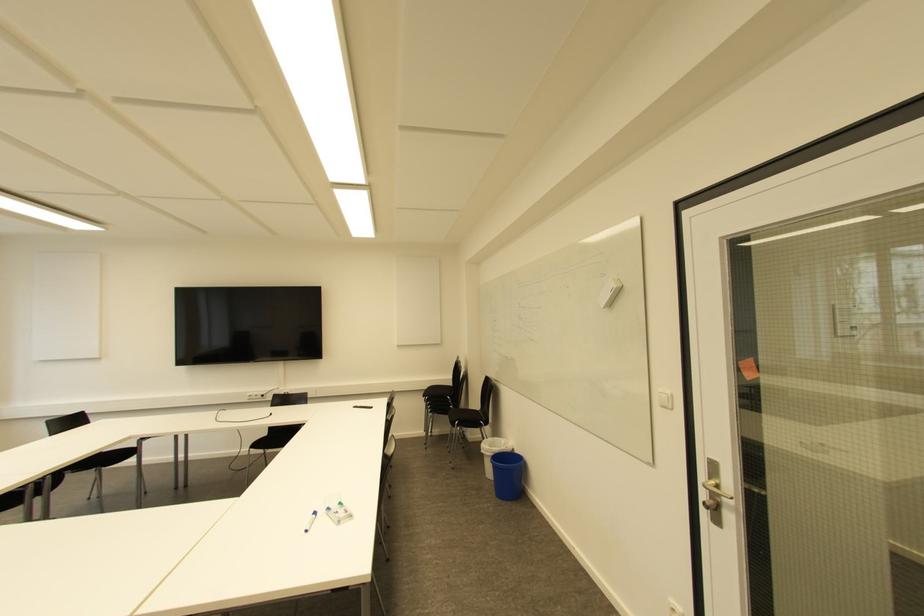
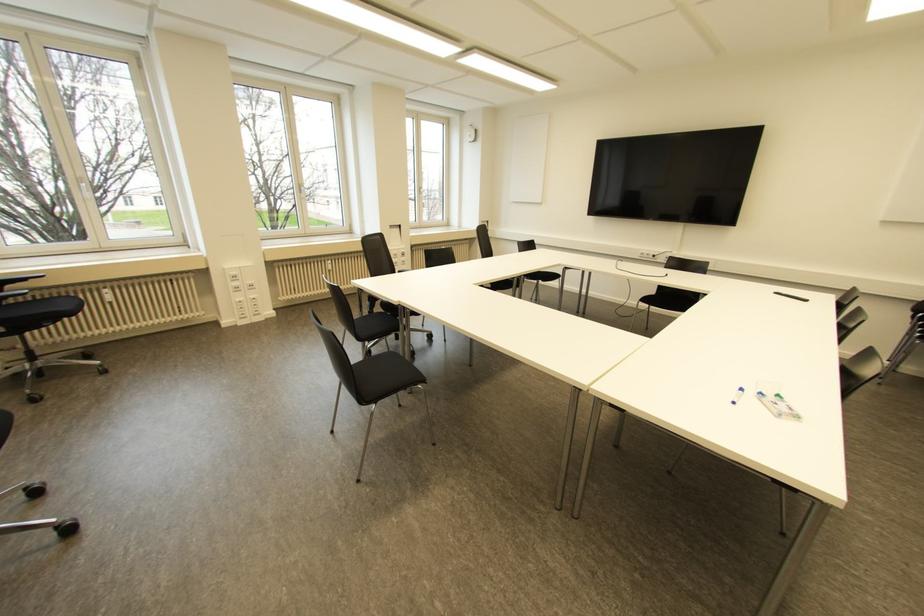
Locate, in the second image, the point that corresponds to pixel 313 514 in the first image.

(739, 390)